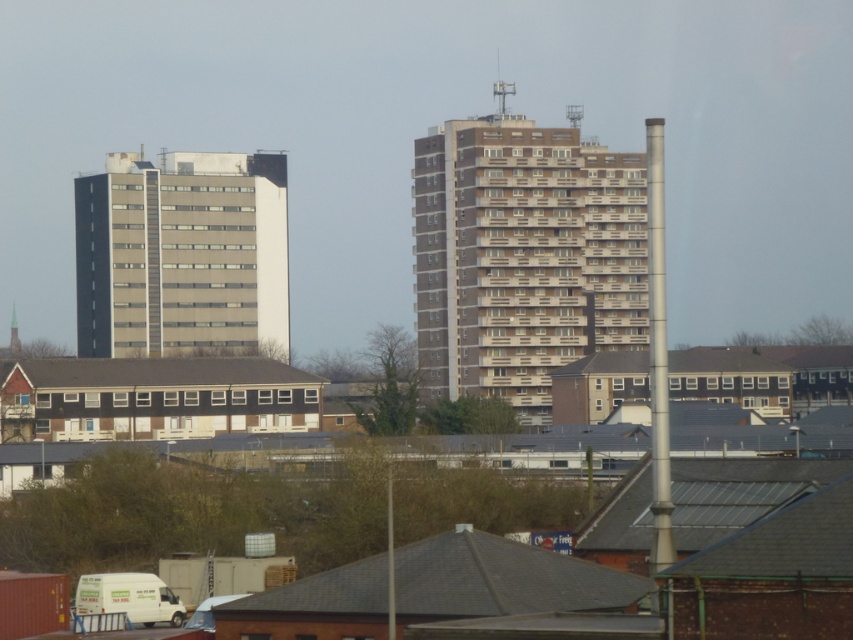
Question: Observing the image, what is the correct spatial positioning of brown concrete building at center in reference to beige concrete building at left?

Choices:
 (A) above
 (B) below

Answer: (B)

Question: Is brown concrete building at center closer to the viewer compared to beige concrete building at left?

Choices:
 (A) yes
 (B) no

Answer: (A)

Question: Is brown concrete building at center smaller than beige concrete building at left?

Choices:
 (A) yes
 (B) no

Answer: (B)

Question: Which point is farther to the camera?

Choices:
 (A) brown concrete building at center
 (B) beige concrete building at left

Answer: (B)